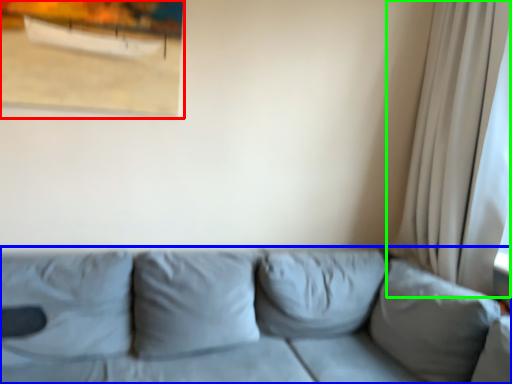
Question: Considering the real-world distances, which object is farthest from picture frame (highlighted by a red box)? studio couch (highlighted by a blue box) or curtain (highlighted by a green box)?

Choices:
 (A) studio couch
 (B) curtain

Answer: (B)